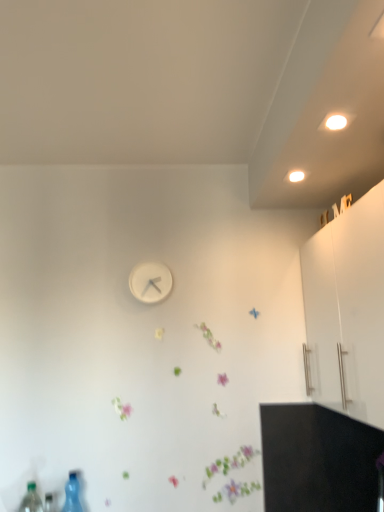
Question: From a real-world perspective, is white matte cabinet at upper right positioned above or below transparent plastic bottle at lower left, which appears as the first bottle when viewed from the right?

Choices:
 (A) above
 (B) below

Answer: (A)

Question: Considering the positions of white matte cabinet at upper right and transparent plastic bottle at lower left, the 2th bottle viewed from the left, in the image, is white matte cabinet at upper right taller or shorter than transparent plastic bottle at lower left, the 2th bottle viewed from the left,?

Choices:
 (A) tall
 (B) short

Answer: (A)

Question: Which object is positioned farthest from the purple matte flower at center?

Choices:
 (A) white matte clock at center
 (B) transparent plastic bottle at lower left, which is counted as the 1th bottle, starting from the back
 (C) transparent plastic bottle at lower left, the 1th bottle in the left-to-right sequence
 (D) white matte cabinet at upper right

Answer: (A)

Question: Which object is positioned farthest from the transparent plastic bottle at lower left, the 1th bottle in the left-to-right sequence?

Choices:
 (A) white matte clock at center
 (B) white matte cabinet at upper right
 (C) purple matte flower at center
 (D) transparent plastic bottle at lower left, which appears as the first bottle when viewed from the right

Answer: (B)